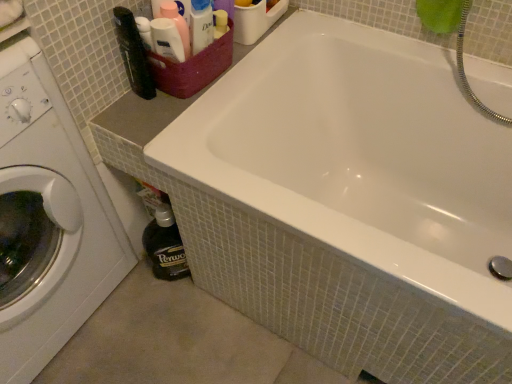
Question: Is white glossy washing machine at left positioned in front of maroon woven basket at upper left?

Choices:
 (A) yes
 (B) no

Answer: (A)

Question: From a real-world perspective, does white glossy washing machine at left stand above maroon woven basket at upper left?

Choices:
 (A) no
 (B) yes

Answer: (A)

Question: Does white glossy washing machine at left appear on the right side of maroon woven basket at upper left?

Choices:
 (A) no
 (B) yes

Answer: (A)

Question: From the image's perspective, would you say white glossy washing machine at left is shown under maroon woven basket at upper left?

Choices:
 (A) no
 (B) yes

Answer: (B)

Question: Is white glossy washing machine at left outside maroon woven basket at upper left?

Choices:
 (A) yes
 (B) no

Answer: (A)

Question: Is point (202, 61) closer or farther from the camera than point (18, 157)?

Choices:
 (A) farther
 (B) closer

Answer: (A)

Question: Is maroon woven basket at upper left inside the boundaries of white glossy washing machine at left, or outside?

Choices:
 (A) outside
 (B) inside

Answer: (A)

Question: Looking at their shapes, would you say maroon woven basket at upper left is wider or thinner than white glossy washing machine at left?

Choices:
 (A) wide
 (B) thin

Answer: (B)

Question: Looking at the image, does maroon woven basket at upper left seem bigger or smaller compared to white glossy washing machine at left?

Choices:
 (A) big
 (B) small

Answer: (B)

Question: Is point (87, 165) closer or farther from the camera than point (229, 26)?

Choices:
 (A) farther
 (B) closer

Answer: (B)

Question: Choose the correct answer: Is white glossy washing machine at left inside maroon woven basket at upper left or outside it?

Choices:
 (A) inside
 (B) outside

Answer: (B)

Question: In terms of height, does white glossy washing machine at left look taller or shorter compared to maroon woven basket at upper left?

Choices:
 (A) tall
 (B) short

Answer: (A)

Question: In terms of width, does white glossy washing machine at left look wider or thinner when compared to maroon woven basket at upper left?

Choices:
 (A) thin
 (B) wide

Answer: (B)

Question: From the image's perspective, is white glossy bathtub at upper center positioned above or below white glossy washing machine at left?

Choices:
 (A) above
 (B) below

Answer: (A)

Question: Relative to white glossy washing machine at left, is white glossy bathtub at upper center in front or behind?

Choices:
 (A) front
 (B) behind

Answer: (B)